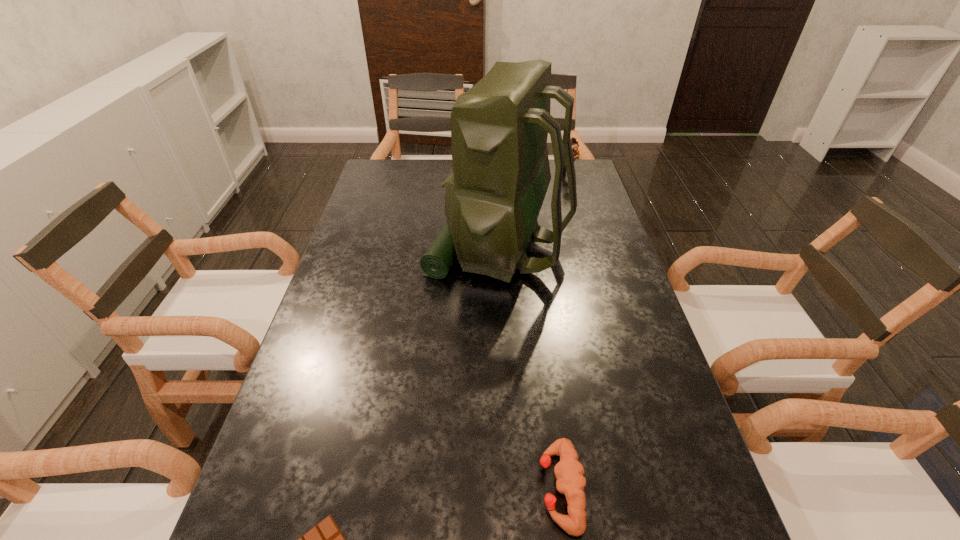
Where is `free region located on the front-facing side of the farther puncher`? The height and width of the screenshot is (540, 960). free region located on the front-facing side of the farther puncher is located at coordinates (490, 173).

Where is `free space located on the front-facing side of the farther puncher`? This screenshot has width=960, height=540. free space located on the front-facing side of the farther puncher is located at coordinates (463, 173).

This screenshot has width=960, height=540. Identify the location of vacant point located 0.200m with the gloves of the left puncher facing forward. (428, 489).

Locate an element on the screen. free region located 0.300m with the gloves of the left puncher facing forward is located at coordinates (372, 489).

Where is `vacant space situated 0.270m with the gloves of the left puncher facing forward`? vacant space situated 0.270m with the gloves of the left puncher facing forward is located at coordinates (390, 489).

Find the location of `object that is positioned at the far edge`. object that is positioned at the far edge is located at coordinates (575, 145).

The image size is (960, 540). I want to click on backpack that is at the right edge, so click(x=499, y=128).

Where is `puncher that is at the right edge`? puncher that is at the right edge is located at coordinates (575, 145).

I want to click on object present at the far right corner, so click(x=575, y=145).

In the image, there is a desktop. Identify the location of vacant region at the left edge. This screenshot has height=540, width=960. (324, 361).